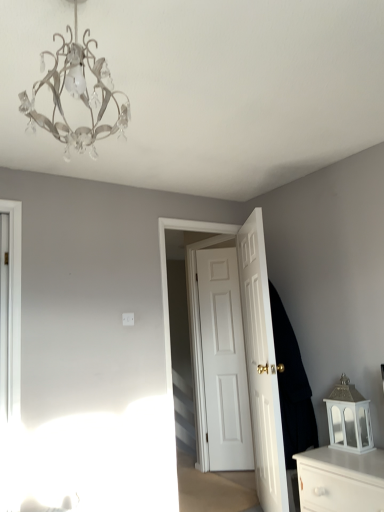
What is the approximate width of white glossy door at center, the second door positioned from the back?

4.83 inches.

In order to face white glossy door at center, the second door positioned from the back, should I rotate leftwards or rightwards?

Rotate your view right by about 3.131°.

This screenshot has height=512, width=384. What do you see at coordinates (224, 361) in the screenshot? I see `white matte door at center, the 1th door viewed from the back` at bounding box center [224, 361].

Find the location of a particular element. This screenshot has height=512, width=384. metallic chandelier at upper left is located at coordinates (76, 95).

What do you see at coordinates (261, 366) in the screenshot? I see `white glossy door at center, the 3th door positioned from the back` at bounding box center [261, 366].

Where is `white glossy door at center, the second door positioned from the back`? white glossy door at center, the second door positioned from the back is located at coordinates (168, 307).

Considering the sizes of objects white glossy door at center, the first door in the front-to-back sequence, and white glossy door at center, the second door positioned from the back, in the image provided, who is shorter, white glossy door at center, the first door in the front-to-back sequence, or white glossy door at center, the second door positioned from the back,?

Standing shorter between the two is white glossy door at center, the first door in the front-to-back sequence.

Is white glossy door at center, the second door positioned from the back, completely or partially inside white glossy door at center, the first door in the front-to-back sequence?

No.

Based on their positions, is white glossy door at center, the first door in the front-to-back sequence, located to the left or right of white glossy door at center, which appears as the 2th door when viewed from the front?

In the image, white glossy door at center, the first door in the front-to-back sequence, appears on the right side of white glossy door at center, which appears as the 2th door when viewed from the front.

Can you tell me how much white glossy door at center, the 3th door positioned from the back, and white glossy door at center, the second door positioned from the back, differ in facing direction?

120 degrees.

From the picture: How different are the orientations of dark matte coat at right and white matte door at center, the third door positioned from the front, in degrees?

5.48 degrees.

From the image's perspective, who appears lower, dark matte coat at right or white matte door at center, the third door positioned from the front?

white matte door at center, the third door positioned from the front, from the image's perspective.

Consider the image. Is dark matte coat at right oriented towards white matte door at center, the 1th door viewed from the back?

No, dark matte coat at right is not oriented towards white matte door at center, the 1th door viewed from the back.

From a real-world perspective, is dark matte coat at right physically located above or below white matte door at center, the third door positioned from the front?

In terms of real-world spatial position, dark matte coat at right is above white matte door at center, the third door positioned from the front.

Is dark matte coat at right placed right next to white glossy door at center, the first door in the front-to-back sequence?

No, dark matte coat at right is not touching white glossy door at center, the first door in the front-to-back sequence.

Does dark matte coat at right have a lesser height compared to white glossy door at center, the first door in the front-to-back sequence?

Indeed, dark matte coat at right has a lesser height compared to white glossy door at center, the first door in the front-to-back sequence.

In terms of width, does dark matte coat at right look wider or thinner when compared to white glossy door at center, the 3th door positioned from the back?

dark matte coat at right is wider than white glossy door at center, the 3th door positioned from the back.

Image resolution: width=384 pixels, height=512 pixels. Identify the location of dark located above the white glossy door at center, the 3th door positioned from the back (from a real-world perspective). (292, 386).

From a real-world perspective, which object rests below the other?

white glossy chest of drawers at lower right is physically lower.

Is white glossy chest of drawers at lower right not close to white matte door at center, the third door positioned from the front?

white glossy chest of drawers at lower right is far away from white matte door at center, the third door positioned from the front.

Considering the positions of objects white glossy chest of drawers at lower right and white matte door at center, the third door positioned from the front, in the image provided, who is more to the right, white glossy chest of drawers at lower right or white matte door at center, the third door positioned from the front,?

Positioned to the right is white glossy chest of drawers at lower right.

Looking at this image, how many degrees apart are the facing directions of white glossy chest of drawers at lower right and white matte door at center, the third door positioned from the front?

49.3 degrees.

Between point (264, 431) and point (277, 300), which one is positioned in front?

Positioned in front is point (264, 431).

Could you tell me if white glossy door at center, the first door in the front-to-back sequence, is turned towards dark matte coat at right?

Yes, white glossy door at center, the first door in the front-to-back sequence, is oriented towards dark matte coat at right.

The image size is (384, 512). In order to click on dark that is behind the white glossy door at center, the 3th door positioned from the back in this screenshot , I will do `click(292, 386)`.

In the scene shown: Can you confirm if white glossy door at center, the 3th door positioned from the back, is wider than dark matte coat at right?

No, white glossy door at center, the 3th door positioned from the back, is not wider than dark matte coat at right.

Could you measure the distance between metallic chandelier at upper left and white glossy door at center, the 3th door positioned from the back?

6.27 feet.

Which is nearer, (72,80) or (261,456)?

Point (72,80) is closer to the camera than point (261,456).

Which object is closer to the camera taking this photo, metallic chandelier at upper left or white glossy door at center, the 3th door positioned from the back?

metallic chandelier at upper left is more forward.

Is metallic chandelier at upper left taller or shorter than white glossy door at center, the 3th door positioned from the back?

In the image, metallic chandelier at upper left appears to be shorter than white glossy door at center, the 3th door positioned from the back.

From their relative heights in the image, would you say dark matte coat at right is taller or shorter than metallic chandelier at upper left?

dark matte coat at right is taller than metallic chandelier at upper left.

From a real-world perspective, between dark matte coat at right and metallic chandelier at upper left, who is vertically lower?

dark matte coat at right.

Is dark matte coat at right spatially inside metallic chandelier at upper left, or outside of it?

dark matte coat at right is located beyond the bounds of metallic chandelier at upper left.

Is point (289, 414) closer or farther from the camera than point (124, 122)?

Point (289, 414) appears to be farther away from the viewer than point (124, 122).

The image size is (384, 512). What are the coordinates of `the 2nd door counting from the left side of the white glossy door at center, the 3th door positioned from the back` in the screenshot? It's located at (168, 307).

Locate an element on the screen. This screenshot has width=384, height=512. dark above the white matte door at center, the third door positioned from the front (from the image's perspective) is located at coordinates (292, 386).

Considering their positions, is white glossy door at center, the 3th door positioned from the back, positioned closer to white glossy chest of drawers at lower right than dark matte coat at right?

dark matte coat at right lies closer to white glossy chest of drawers at lower right than the other object.

Looking at the image, which one is located closer to metallic chandelier at upper left, white glossy door at center, the 3th door positioned from the back, or white glossy door at center, which appears as the 2th door when viewed from the front?

Based on the image, white glossy door at center, which appears as the 2th door when viewed from the front, appears to be nearer to metallic chandelier at upper left.

Based on their spatial positions, is white matte door at center, the third door positioned from the front, or dark matte coat at right closer to white glossy door at center, the 3th door positioned from the back?

dark matte coat at right.

Which object lies nearer to the anchor point white glossy door at center, the 3th door positioned from the back, white glossy door at center, the second door positioned from the back, or dark matte coat at right?

dark matte coat at right.

When comparing their distances from white glossy chest of drawers at lower right, does white matte door at center, the third door positioned from the front, or white glossy door at center, the 3th door positioned from the back, seem further?

Among the two, white matte door at center, the third door positioned from the front, is located further to white glossy chest of drawers at lower right.

Based on their spatial positions, is white matte door at center, the third door positioned from the front, or metallic chandelier at upper left closer to white glossy door at center, the second door positioned from the back?

The object closer to white glossy door at center, the second door positioned from the back, is white matte door at center, the third door positioned from the front.

Which object lies further to the anchor point white glossy door at center, which appears as the 2th door when viewed from the front, white glossy chest of drawers at lower right or white glossy door at center, the 3th door positioned from the back?

white glossy chest of drawers at lower right.

Considering their positions, is white glossy door at center, the 3th door positioned from the back, positioned further to white matte door at center, the third door positioned from the front, than white glossy chest of drawers at lower right?

Based on the image, white glossy chest of drawers at lower right appears to be further to white matte door at center, the third door positioned from the front.

Identify the location of dark positioned between metallic chandelier at upper left and white glossy door at center, the second door positioned from the back, from near to far. (292, 386).

The image size is (384, 512). Identify the location of door positioned between dark matte coat at right and white matte door at center, the third door positioned from the front, from near to far. (168, 307).

The image size is (384, 512). I want to click on dark located between white glossy chest of drawers at lower right and white glossy door at center, which appears as the 2th door when viewed from the front, in the depth direction, so click(292, 386).

Locate an element on the screen. The width and height of the screenshot is (384, 512). door positioned between white glossy chest of drawers at lower right and white glossy door at center, which appears as the 2th door when viewed from the front, from near to far is located at coordinates (261, 366).